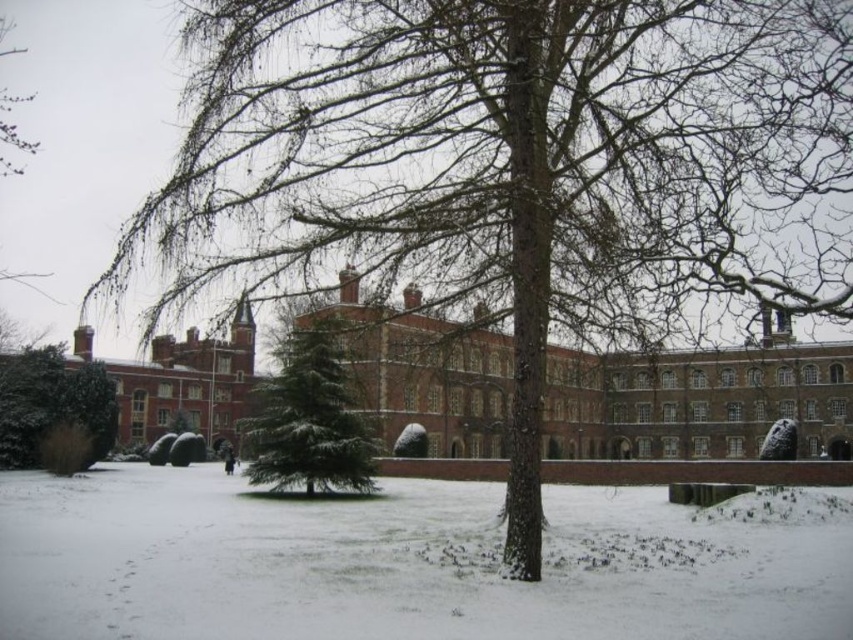
You are a visitor at the historic building and want to take a photo of the green matte tree at center. To get a better view, you need to stand on the white powdery snow at center. Will the snow be tall enough to give you a higher vantage point than the tree?

The white powdery snow at center has a lesser height compared to green matte tree at center, so standing on the snow will not provide a higher vantage point than the tree.

You are an architect analyzing the symmetry of the building in the winter scene. You notice the white powdery snow at center and the green matte tree at center. Which object occupies more horizontal space in the image?

The white powdery snow at center occupies more horizontal space than the green matte tree at center because its width is larger according to the description.

In the scene shown: You are a delivery person trying to navigate through the snow to reach the building. The white powdery snow at center and the green matte tree at left are in your path. Which obstacle is larger and might require more effort to navigate around?

The white powdery snow at center is bigger than the green matte tree at left, so it might require more effort to navigate around.